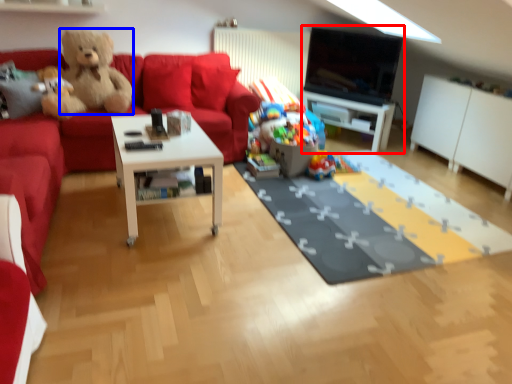
Question: Which object appears farthest to the camera in this image, entertainment center (highlighted by a red box) or teddy bear (highlighted by a blue box)?

Choices:
 (A) entertainment center
 (B) teddy bear

Answer: (A)